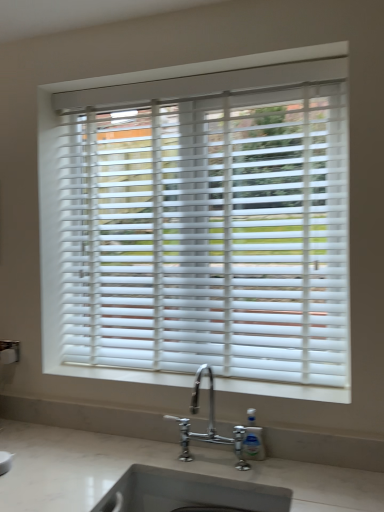
This screenshot has height=512, width=384. What are the coordinates of `free spot to the left of chrome metallic faucet at lower center` in the screenshot? It's located at (157, 455).